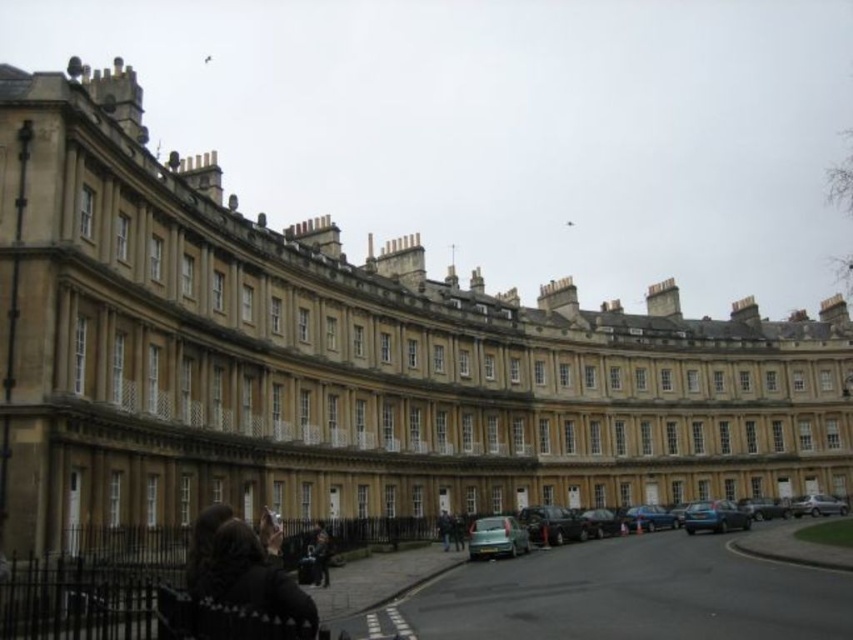
Consider the image. You are a delivery person approaching the building and need to place a package near the dark brown leather jacket at lower left without blocking the matte black car at center. Can you confirm if the jacket is in front of or behind the car?

The dark brown leather jacket at lower left is closer to the viewer than the matte black car at center, so it is in front of the car. Therefore, placing the package near the jacket would not block the car.

You are a delivery person needing to park your 5 meter long truck between the matte black car at center and the shiny blue sedan at lower right. Can you fit your truck there?

The distance between the matte black car at center and the shiny blue sedan at lower right is 11.08 meters, so yes, the truck can fit as it is only 5 meters long.